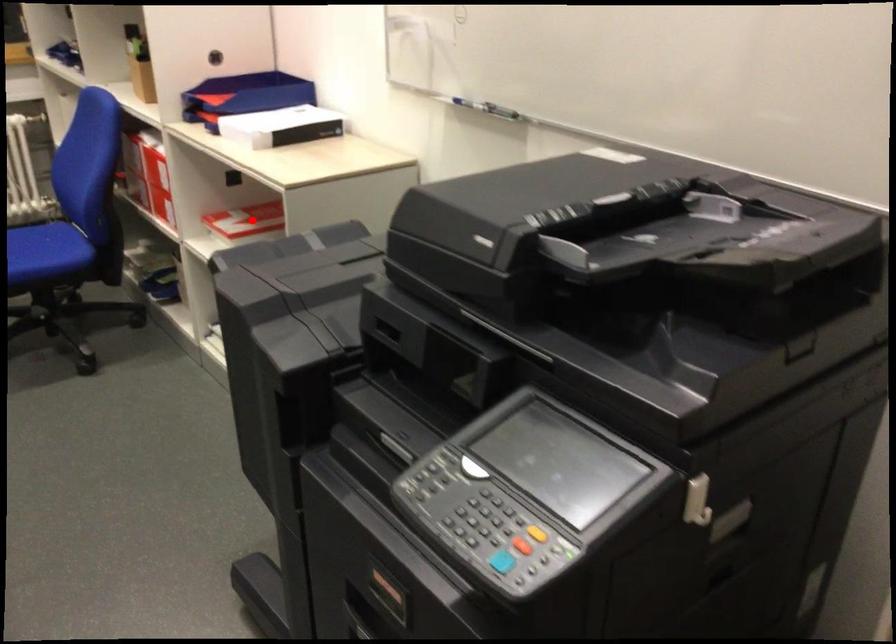
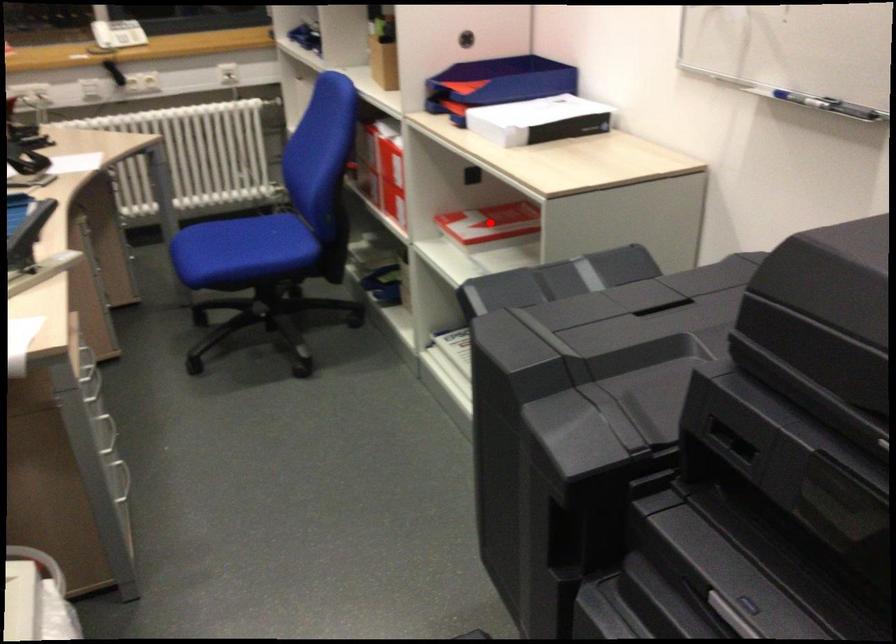
I am providing you with two images of the same scene from different viewpoints. A red point is marked on the first image and another point is marked on the second image. Does the point marked in image1 correspond to the same location as the one in image2?

Yes